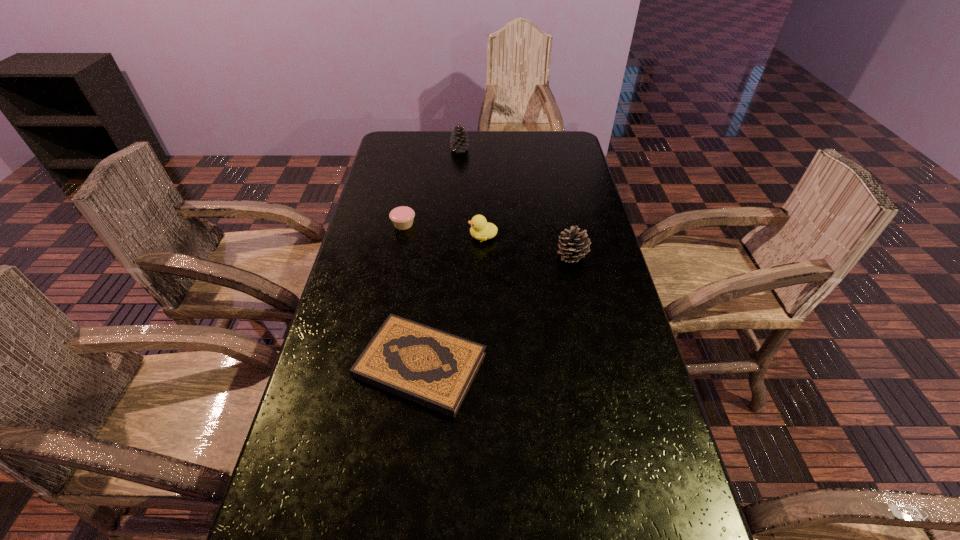
Locate an element on the screen. This screenshot has height=540, width=960. vacant space situated 0.280m at the beak of the third tallest object is located at coordinates (378, 237).

You are a GUI agent. You are given a task and a screenshot of the screen. Output one action in this format:
    pyautogui.click(x=<x>, y=<y>)
    Task: Click on the free space located 0.060m at the beak of the third tallest object
    The image size is (960, 540).
    Given the screenshot: What is the action you would take?
    pyautogui.click(x=449, y=237)

The height and width of the screenshot is (540, 960). Identify the location of free space located at the beak of the third tallest object. (401, 237).

Locate an element on the screen. The width and height of the screenshot is (960, 540). vacant space located 0.060m on the left of the cupcake is located at coordinates (372, 224).

This screenshot has width=960, height=540. I want to click on vacant space located 0.070m on the right of the shortest object, so click(516, 366).

Locate an element on the screen. The image size is (960, 540). object that is at the far edge is located at coordinates (458, 143).

The height and width of the screenshot is (540, 960). I want to click on cupcake present at the left edge, so [402, 217].

At what (x,y) coordinates should I click in order to perform the action: click on hardback book located at the left edge. Please return your answer as a coordinate pair (x, y). The image size is (960, 540). Looking at the image, I should click on (430, 367).

At what (x,y) coordinates should I click in order to perform the action: click on object that is at the right edge. Please return your answer as a coordinate pair (x, y). This screenshot has height=540, width=960. Looking at the image, I should click on (573, 246).

In order to click on vacant space at the far edge of the desktop in this screenshot , I will do `click(491, 132)`.